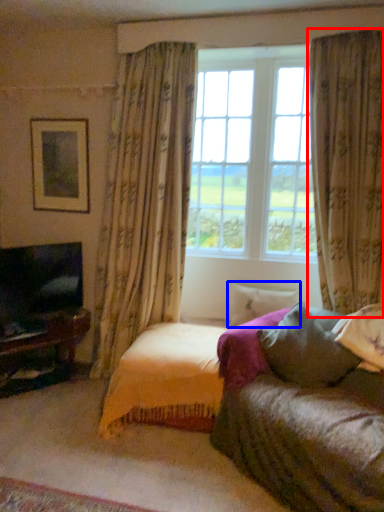
Question: Which object appears closest to the camera in this image, curtain (highlighted by a red box) or pillow (highlighted by a blue box)?

Choices:
 (A) curtain
 (B) pillow

Answer: (A)